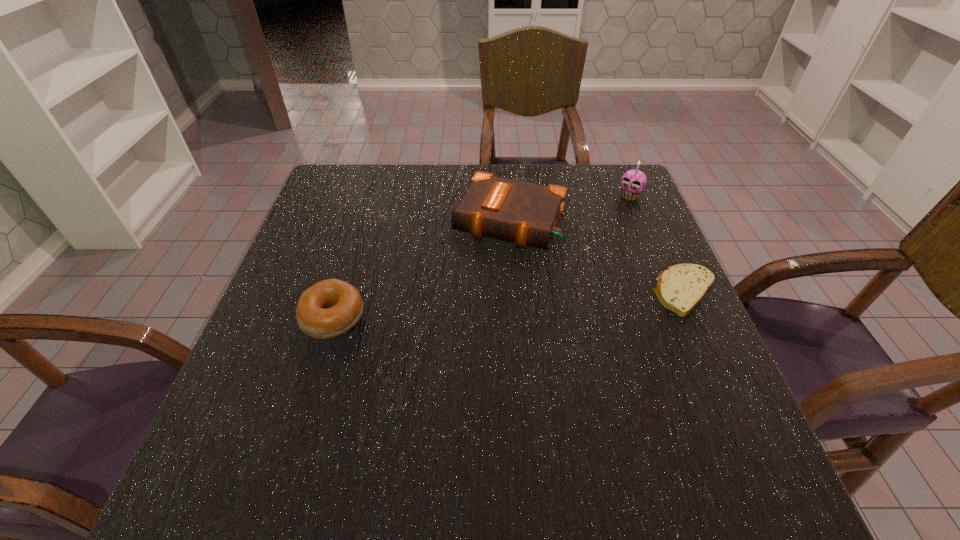
This screenshot has width=960, height=540. Find the location of `empty location between the pita bread and the bagel`. empty location between the pita bread and the bagel is located at coordinates (510, 305).

You are a GUI agent. You are given a task and a screenshot of the screen. Output one action in this format:
    pyautogui.click(x=<x>, y=<y>)
    Task: Click on the vacant area that lies between the leftmost object and the second tallest object
    The image size is (960, 540).
    Given the screenshot: What is the action you would take?
    pyautogui.click(x=421, y=269)

Find the location of a particular element. The height and width of the screenshot is (540, 960). vacant area that lies between the shortest object and the leftmost object is located at coordinates (510, 305).

The height and width of the screenshot is (540, 960). Find the location of `vacant point located between the leftmost object and the tallest object`. vacant point located between the leftmost object and the tallest object is located at coordinates (482, 257).

Locate an element on the screen. The height and width of the screenshot is (540, 960). vacant area between the cupcake and the third tallest object is located at coordinates (482, 257).

Find the location of `free spot between the tallest object and the Bible`. free spot between the tallest object and the Bible is located at coordinates (570, 208).

Locate an element on the screen. The width and height of the screenshot is (960, 540). object that is the third closest to the shortest object is located at coordinates (328, 309).

Identify which object is located as the third nearest to the third tallest object. Please provide its 2D coordinates. Your answer should be formatted as a tuple, i.e. [(x, y)], where the tuple contains the x and y coordinates of a point satisfying the conditions above.

[(633, 182)]

The width and height of the screenshot is (960, 540). I want to click on free location that satisfies the following two spatial constraints: 1. on the back side of the cupcake; 2. on the right side of the bagel, so click(x=371, y=196).

In order to click on vacant area that satisfies the following two spatial constraints: 1. on the back side of the tallest object; 2. on the left side of the Bible in this screenshot , I will do `click(508, 196)`.